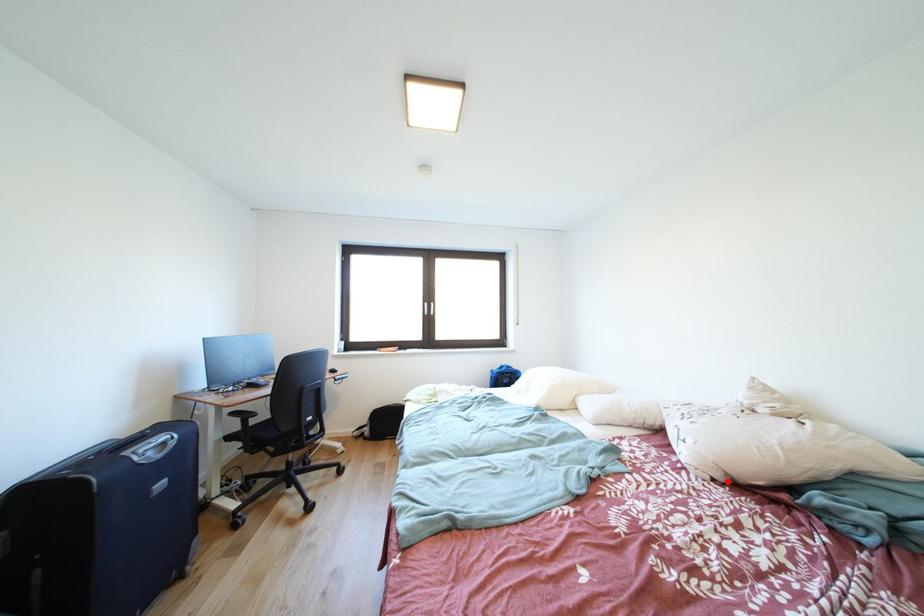
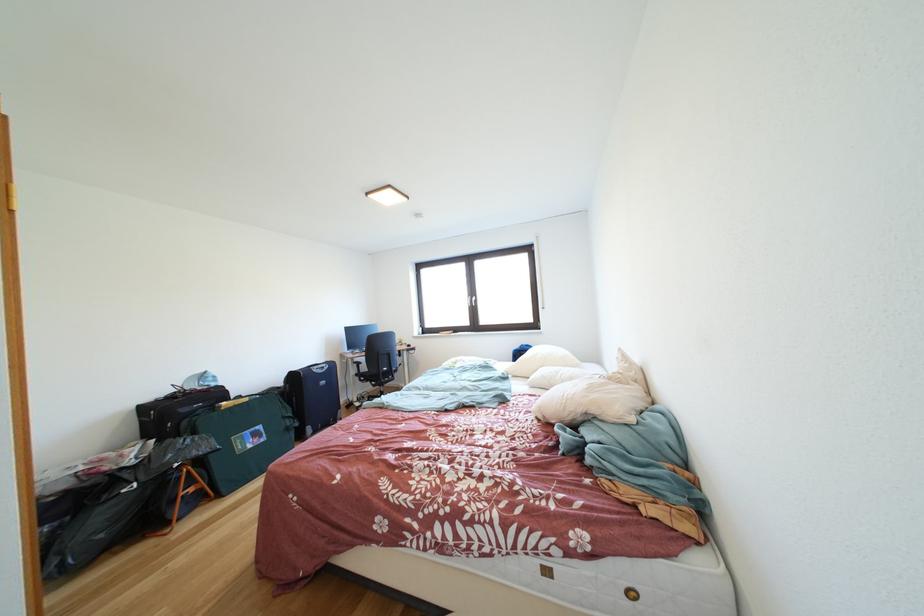
The point at the highlighted location is marked in the first image. Where is the corresponding point in the second image?

(549, 421)